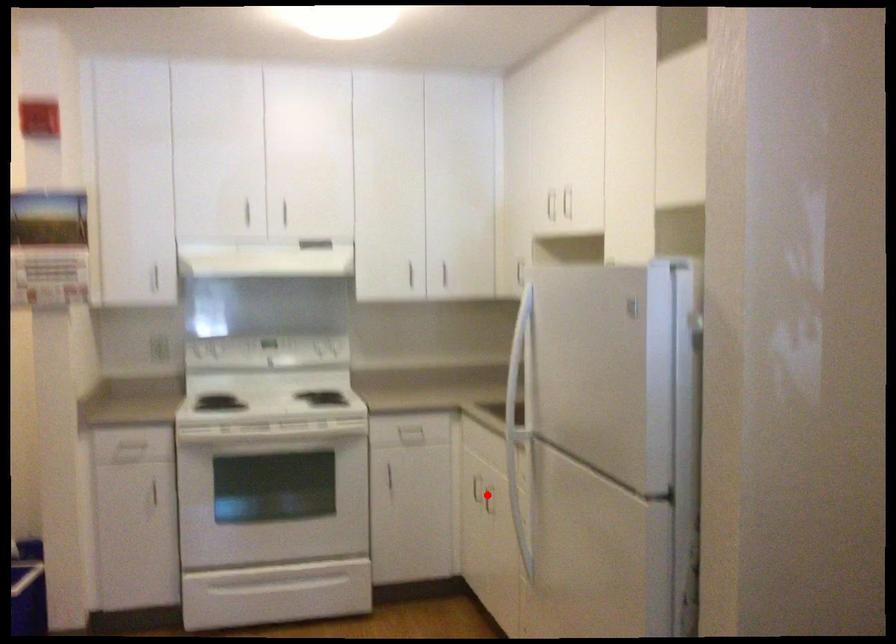
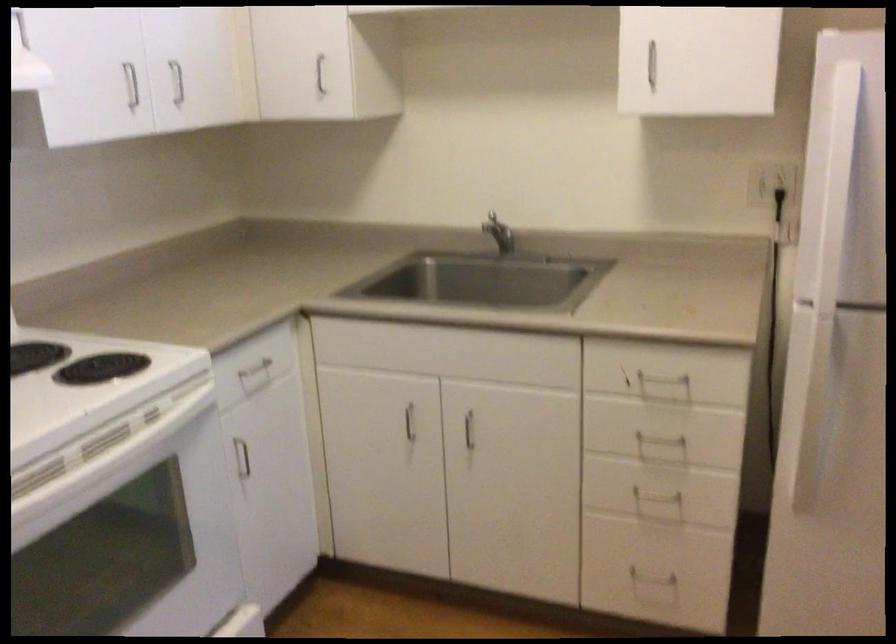
Where in the second image is the point corresponding to the highlighted location from the first image?

(469, 430)